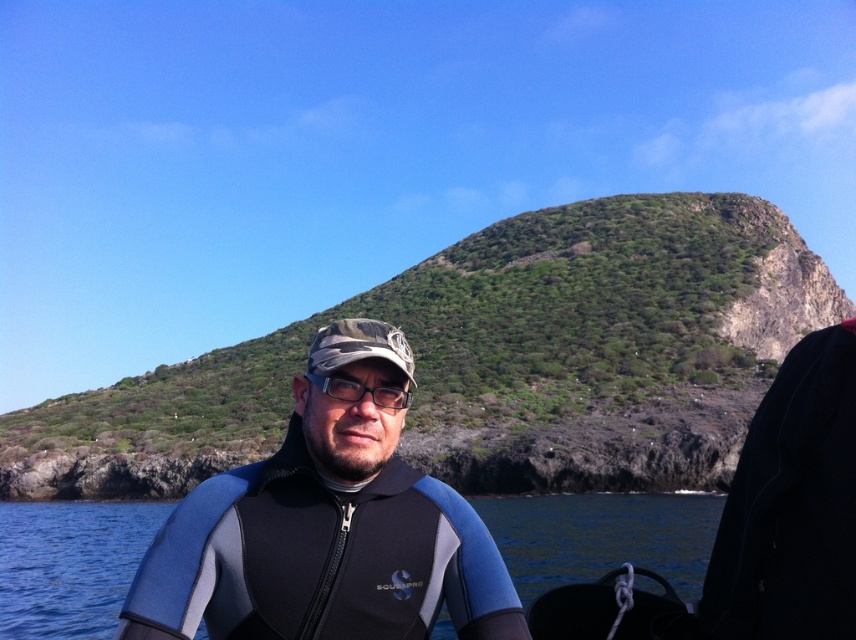
Question: Is blue neoprene wetsuit at center above blue matte water at center?

Choices:
 (A) no
 (B) yes

Answer: (B)

Question: Considering the real-world distances, which object is farthest from the transparent plastic glasses at center?

Choices:
 (A) blue matte water at center
 (B) blue neoprene wetsuit at center

Answer: (A)

Question: Is blue neoprene wetsuit at center thinner than blue matte water at center?

Choices:
 (A) no
 (B) yes

Answer: (B)

Question: Which of the following is the farthest from the observer?

Choices:
 (A) (402, 406)
 (B) (325, 499)

Answer: (A)

Question: Which object is farther from the camera taking this photo?

Choices:
 (A) blue neoprene wetsuit at center
 (B) blue matte water at center

Answer: (B)

Question: Can you confirm if blue neoprene wetsuit at center is positioned below blue matte water at center?

Choices:
 (A) no
 (B) yes

Answer: (A)